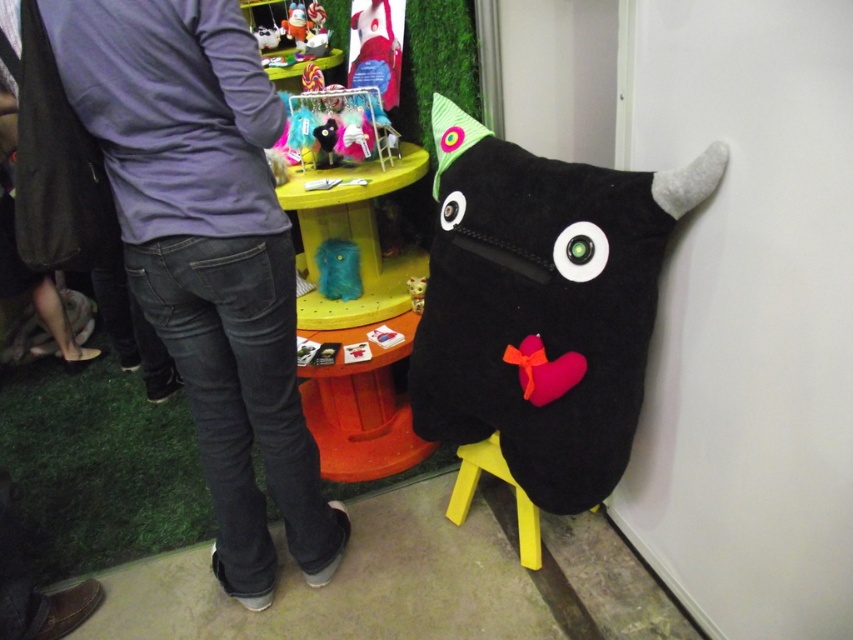
You are standing in the store and see two points marked in the image. The first point is at coordinate point (416, 385) and the second is at point (341, 259). Which point is closer to you?

Point (416, 385) is in front of point (341, 259), so the first point is closer to you.

You are a customer in the store and want to pick up the soft plush toy at right and the teal felt pouch at center. Which item should you move towards first if you are standing to the left of both items?

Since the soft plush toy at right is positioned on the right side of the teal felt pouch at center, you should move towards the teal felt pouch at center first as it is closer to your current position on the left.